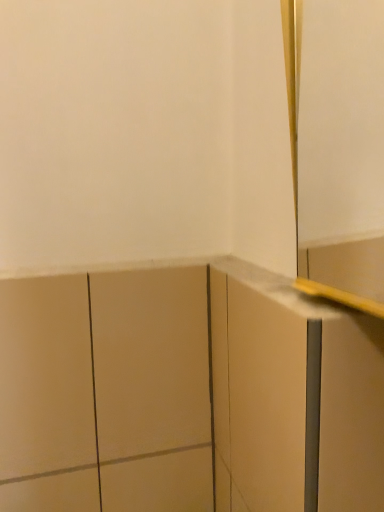
What are the coordinates of `matte white cabinet at center` in the screenshot? It's located at (293, 396).

What is the approximate width of matte white cabinet at center?

matte white cabinet at center is 2.12 inches in width.

Describe the element at coordinates (293, 396) in the screenshot. The height and width of the screenshot is (512, 384). I see `matte white cabinet at center` at that location.

Where is `matte white cabinet at center`? matte white cabinet at center is located at coordinates (293, 396).